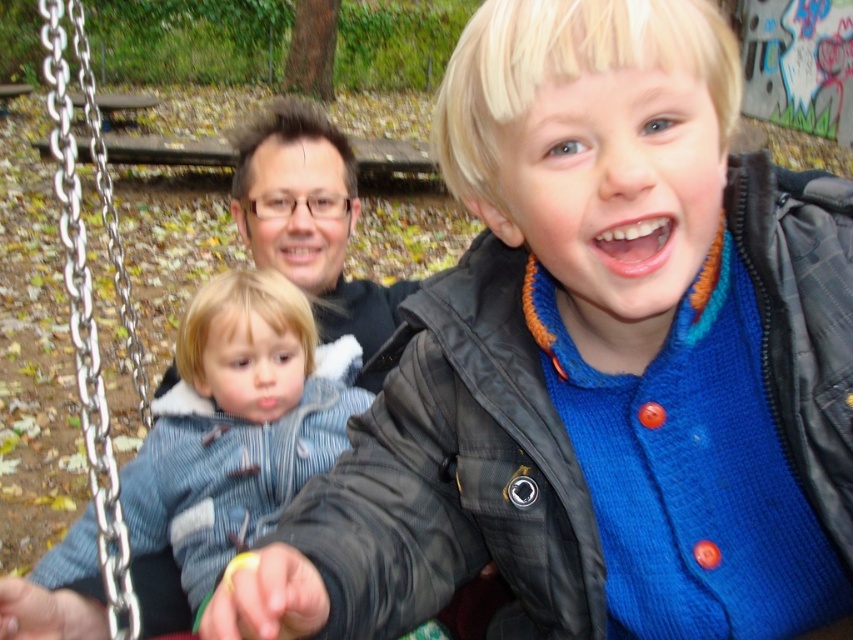
The height and width of the screenshot is (640, 853). I want to click on denim jacket at left, so click(x=236, y=426).

At what (x,y) coordinates should I click in order to perform the action: click on denim jacket at left. Please return your answer as a coordinate pair (x, y). The image size is (853, 640). Looking at the image, I should click on (236, 426).